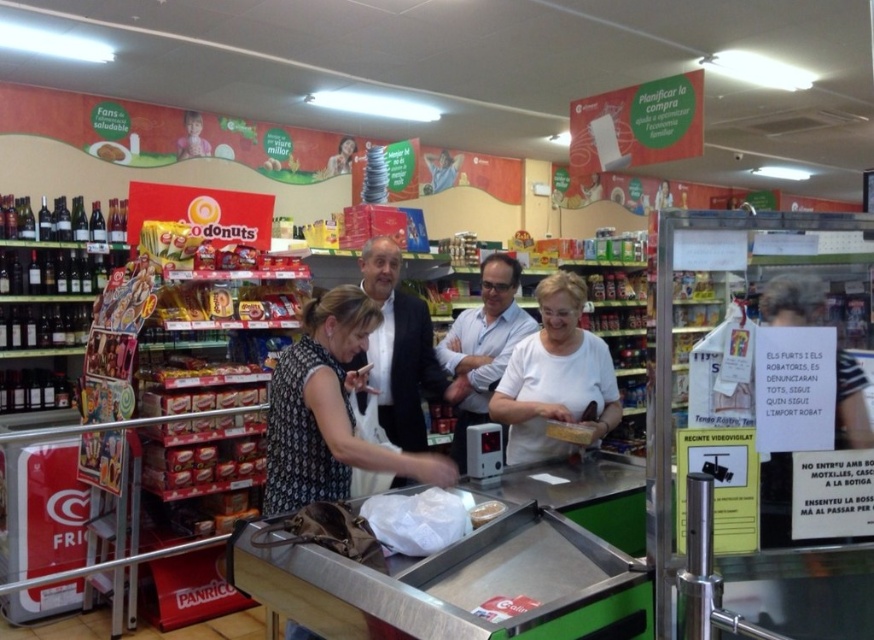
Is white matte shirt at center taller than matte cardboard snack at center?

Indeed, white matte shirt at center has a greater height compared to matte cardboard snack at center.

Is white matte shirt at center above matte cardboard snack at center?

No, white matte shirt at center is not above matte cardboard snack at center.

The width and height of the screenshot is (874, 640). I want to click on white matte shirt at center, so click(x=555, y=376).

How distant is translucent plastic container at center from matte cardboard snack at center?

translucent plastic container at center is 4.44 meters from matte cardboard snack at center.

Between point (473, 525) and point (105, 154), which one is positioned behind?

The point (105, 154) is behind.

Who is more forward, (484, 504) or (98, 152)?

Point (484, 504)

Locate an element on the screen. translucent plastic container at center is located at coordinates (484, 512).

Which is behind, point (564, 438) or point (113, 141)?

The point (113, 141) is more distant.

Looking at this image, measure the distance between translucent plastic bag at center and matte cardboard snack at center.

4.23 meters

Image resolution: width=874 pixels, height=640 pixels. What do you see at coordinates (571, 432) in the screenshot? I see `translucent plastic bag at center` at bounding box center [571, 432].

The width and height of the screenshot is (874, 640). In order to click on translucent plastic bag at center in this screenshot , I will do `click(571, 432)`.